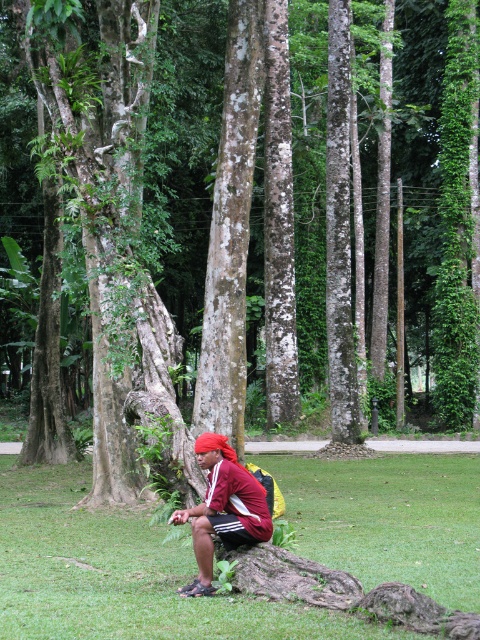
Does green grass at lower center have a greater width compared to maroon fabric shirt at center?

Yes, green grass at lower center is wider than maroon fabric shirt at center.

Can you confirm if green grass at lower center is bigger than maroon fabric shirt at center?

Yes.

Identify the location of green grass at lower center. This screenshot has width=480, height=640. (124, 576).